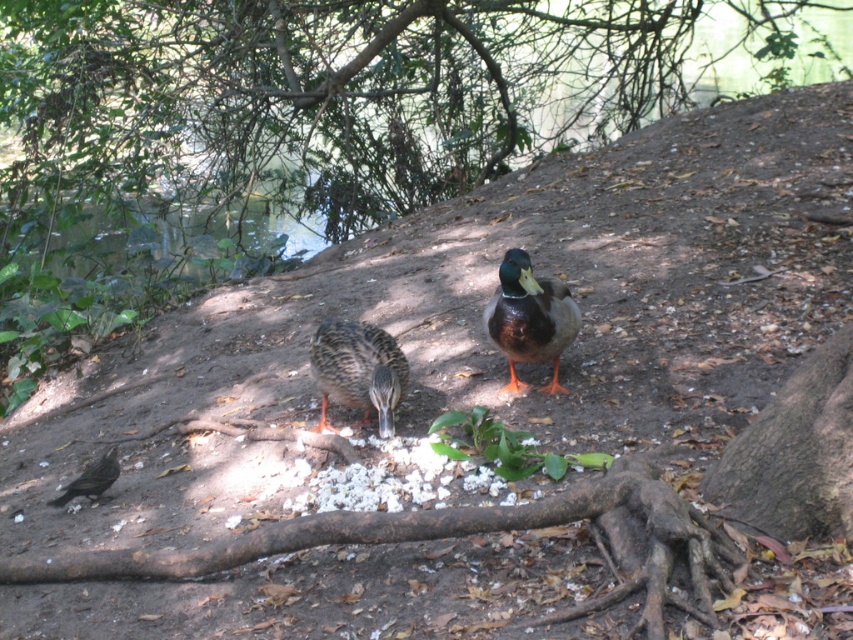
Question: Can you confirm if green leafy tree at upper center is smaller than shiny black bird at lower left?

Choices:
 (A) no
 (B) yes

Answer: (A)

Question: Does green leafy tree at upper center have a smaller size compared to brown speckled duck at center?

Choices:
 (A) yes
 (B) no

Answer: (B)

Question: Among these objects, which one is nearest to the camera?

Choices:
 (A) brown speckled duck at center
 (B) shiny black bird at lower left
 (C) green leafy tree at upper center

Answer: (A)

Question: Is green leafy tree at upper center behind shiny black bird at lower left?

Choices:
 (A) no
 (B) yes

Answer: (B)

Question: Which of these objects is positioned closest to the green leafy tree at upper center?

Choices:
 (A) brown speckled duck at center
 (B) shiny brown duck at center
 (C) shiny black bird at lower left

Answer: (B)

Question: Among these points, which one is nearest to the camera?

Choices:
 (A) (61, 493)
 (B) (515, 358)
 (C) (810, 6)
 (D) (381, 376)

Answer: (D)